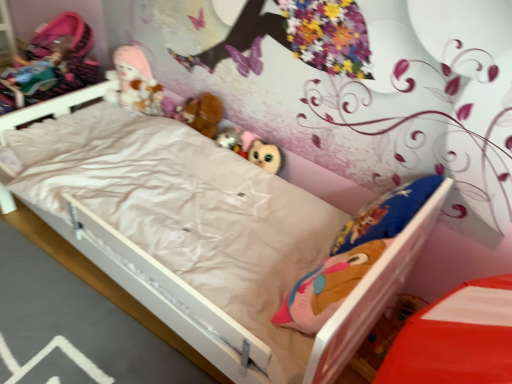
Question: Can you confirm if fluffy plush toys at upper center, the 3th toy viewed from the front, is wider than matte pink fabric doll at upper left, which is the 2th doll from right to left?

Choices:
 (A) yes
 (B) no

Answer: (B)

Question: From the image's perspective, would you say fluffy plush toys at upper center, the 1th toy in the top-to-bottom sequence, is positioned over matte pink fabric doll at upper left, the first doll from the left?

Choices:
 (A) no
 (B) yes

Answer: (A)

Question: Does fluffy plush toys at upper center, the 1th toy in the top-to-bottom sequence, have a smaller size compared to matte pink fabric doll at upper left, the first doll from the left?

Choices:
 (A) yes
 (B) no

Answer: (A)

Question: Is fluffy plush toys at upper center, which is the 3th toy from right to left, outside of matte pink fabric doll at upper left, which is the 2th doll from right to left?

Choices:
 (A) no
 (B) yes

Answer: (B)

Question: Is fluffy plush toys at upper center, which is the first toy from left to right, positioned behind matte pink fabric doll at upper left, the first doll from the left?

Choices:
 (A) no
 (B) yes

Answer: (B)

Question: From a real-world perspective, is fluffy plush toys at upper center, the 3th toy viewed from the front, on top of matte pink fabric doll at upper left, which is the 2th doll from right to left?

Choices:
 (A) yes
 (B) no

Answer: (B)

Question: Would you say fuzzy fabric plush at center, the 2th toy positioned from the bottom, is part of brown plush at center, arranged as the first doll when viewed from the right,'s contents?

Choices:
 (A) yes
 (B) no

Answer: (B)

Question: Is brown plush at center, arranged as the first doll when viewed from the right, shorter than fuzzy fabric plush at center, positioned as the 2th toy in back-to-front order?

Choices:
 (A) no
 (B) yes

Answer: (A)

Question: Is brown plush at center, arranged as the first doll when viewed from the right, facing towards fuzzy fabric plush at center, marked as the 2th toy in a front-to-back arrangement?

Choices:
 (A) no
 (B) yes

Answer: (A)

Question: Does brown plush at center, arranged as the first doll when viewed from the right, come behind fuzzy fabric plush at center, positioned as the 2th toy in back-to-front order?

Choices:
 (A) no
 (B) yes

Answer: (B)

Question: Is brown plush at center, arranged as the first doll when viewed from the right, looking in the opposite direction of fuzzy fabric plush at center, arranged as the second toy when viewed from the top?

Choices:
 (A) yes
 (B) no

Answer: (B)

Question: Can we say brown plush at center, the second doll from the left, lies outside fuzzy fabric plush at center, marked as the 2th toy in a front-to-back arrangement?

Choices:
 (A) no
 (B) yes

Answer: (B)

Question: Can you confirm if fuzzy fabric plush at center, the 2th toy when ordered from left to right, is smaller than brown plush at center, arranged as the first doll when viewed from the right?

Choices:
 (A) no
 (B) yes

Answer: (B)